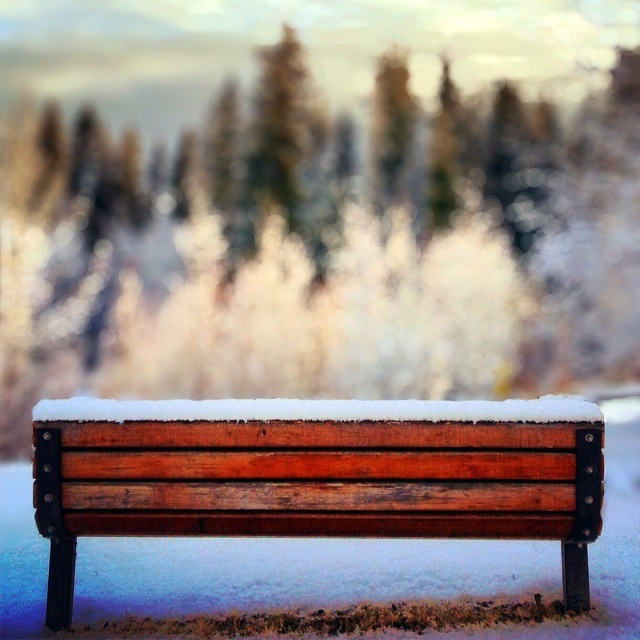
Can you confirm if wooden bench at center is taller than white fluffy snow at center?

Yes.

Who is shorter, wooden bench at center or white fluffy snow at center?

white fluffy snow at center is shorter.

Find the location of a particular element. Image resolution: width=640 pixels, height=640 pixels. wooden bench at center is located at coordinates (316, 474).